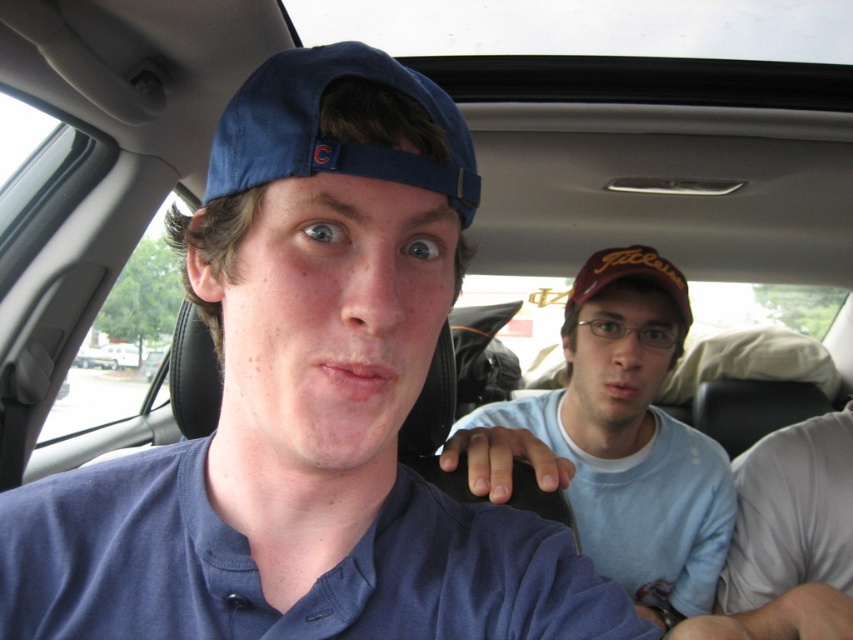
Question: Is the position of light blue cotton shirt at center more distant than that of brown matte cap at center?

Choices:
 (A) no
 (B) yes

Answer: (A)

Question: Does light blue cotton shirt at center appear under blue fabric cap at upper center?

Choices:
 (A) yes
 (B) no

Answer: (A)

Question: Is blue fabric cap at upper center smaller than brown matte cap at center?

Choices:
 (A) no
 (B) yes

Answer: (B)

Question: Which object appears closest to the camera in this image?

Choices:
 (A) blue fabric cap at upper center
 (B) brown matte cap at center

Answer: (A)

Question: Which is farther from the light blue cotton shirt at center?

Choices:
 (A) brown matte cap at center
 (B) blue fabric cap at upper center

Answer: (B)

Question: Estimate the real-world distances between objects in this image. Which object is closer to the light blue cotton shirt at center?

Choices:
 (A) brown matte cap at center
 (B) blue fabric cap at upper center

Answer: (A)